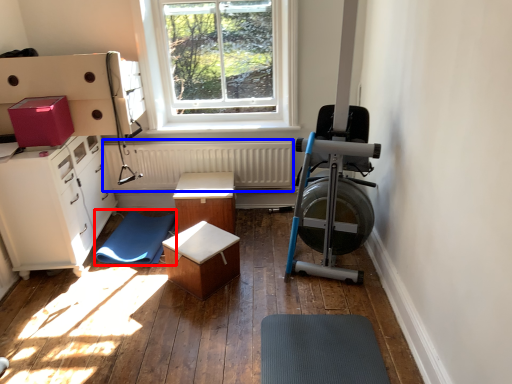
Question: Which object is further to the camera taking this photo, mat (highlighted by a red box) or radiator (highlighted by a blue box)?

Choices:
 (A) mat
 (B) radiator

Answer: (B)